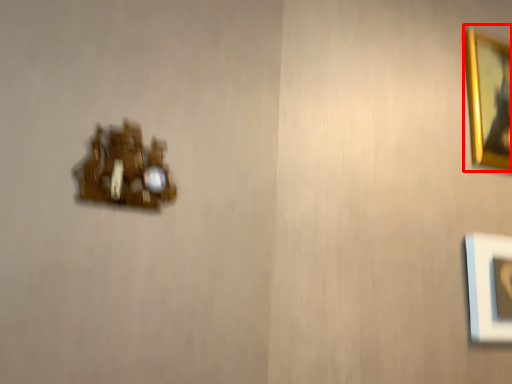
Question: From the image's perspective, considering the relative positions of picture frame (annotated by the red box) and portrait in the image provided, where is picture frame (annotated by the red box) located with respect to the staircase?

Choices:
 (A) above
 (B) below

Answer: (A)